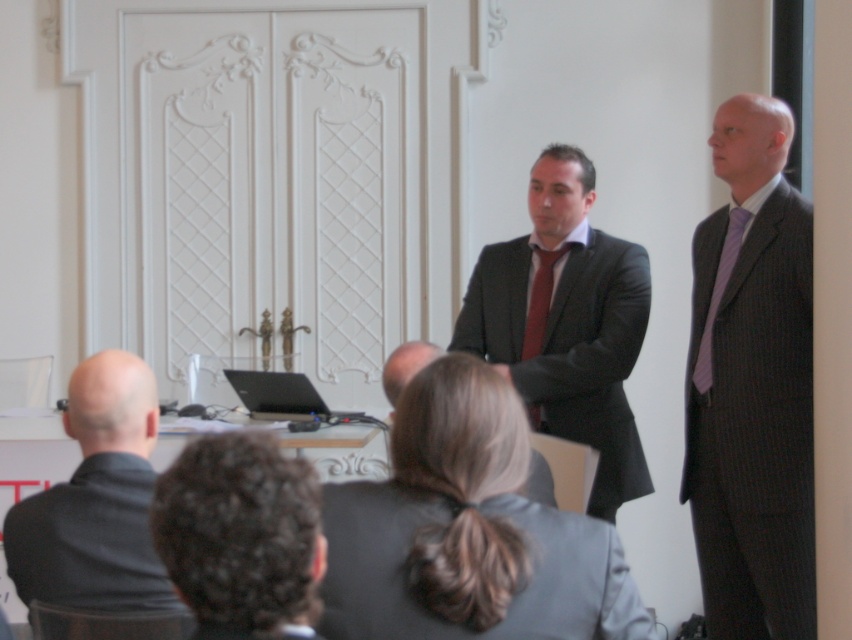
Question: Can you confirm if matte black suit at center is positioned to the right of matte red tie at center?

Choices:
 (A) no
 (B) yes

Answer: (B)

Question: Is dark gray checkered suit at right below curly hair at lower left?

Choices:
 (A) yes
 (B) no

Answer: (B)

Question: Among these objects, which one is nearest to the camera?

Choices:
 (A) purple silk tie at right
 (B) matte red tie at center
 (C) black matte suit at left

Answer: (C)

Question: In this image, where is curly hair at lower left located relative to black matte suit at left?

Choices:
 (A) above
 (B) below

Answer: (A)

Question: Among these points, which one is farthest from the camera?

Choices:
 (A) pyautogui.click(x=27, y=582)
 (B) pyautogui.click(x=216, y=545)
 (C) pyautogui.click(x=404, y=444)

Answer: (A)

Question: Which object is positioned closest to the matte black suit at center?

Choices:
 (A) gray fabric jacket at center
 (B) dark gray suit at center
 (C) purple silk tie at right

Answer: (C)